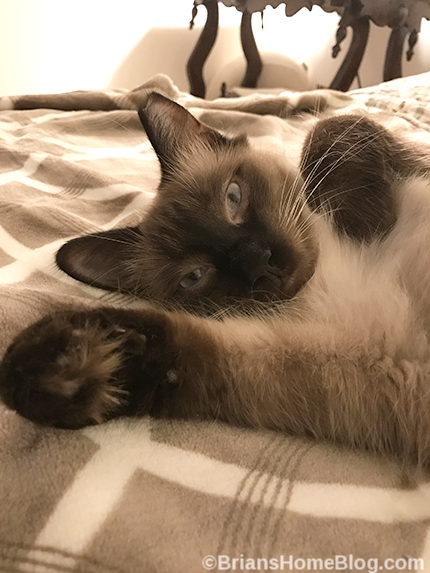
You are a GUI agent. You are given a task and a screenshot of the screen. Output one action in this format:
    pyautogui.click(x=<x>, y=<y>)
    Task: Click on the bright light
    
    Given the screenshot: What is the action you would take?
    pyautogui.click(x=292, y=26)